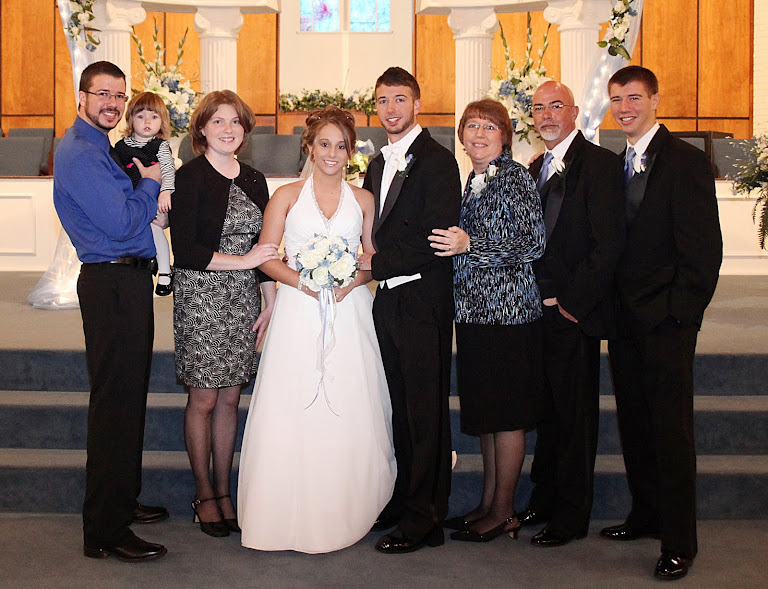
I want to click on carved pilar, so click(x=222, y=31), click(x=114, y=37), click(x=464, y=59), click(x=574, y=61).